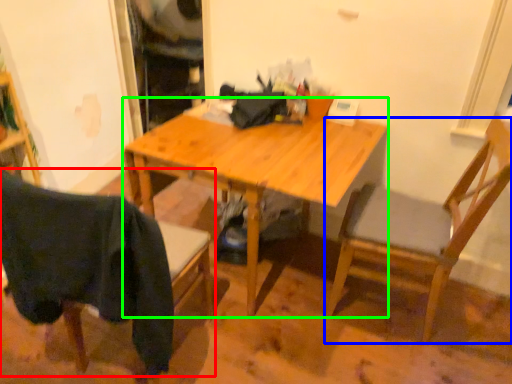
Question: Estimate the real-world distances between objects in this image. Which object is closer to chair (highlighted by a red box), chair (highlighted by a blue box) or desk (highlighted by a green box)?

Choices:
 (A) chair
 (B) desk

Answer: (B)